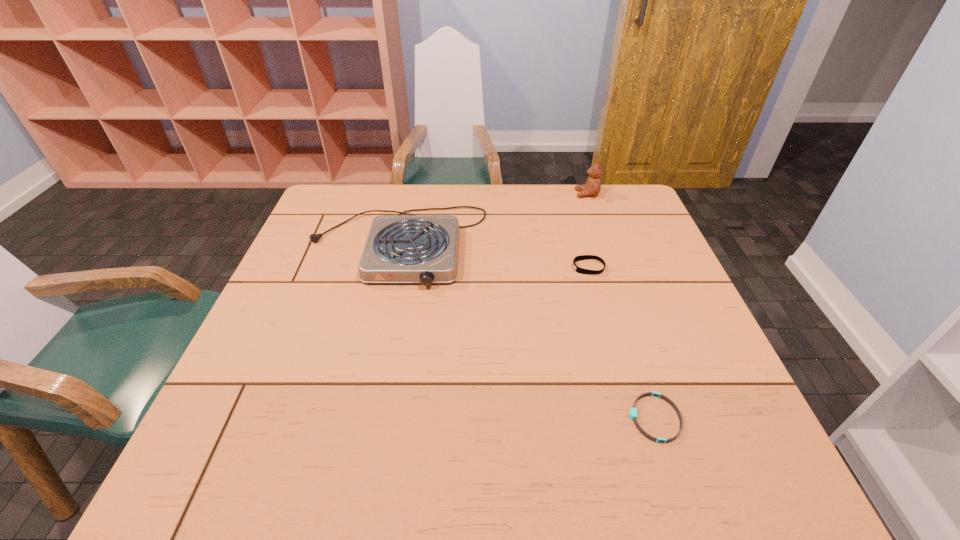
I want to click on free space between the third tallest object and the hotplate, so click(x=492, y=256).

You are a GUI agent. You are given a task and a screenshot of the screen. Output one action in this format:
    pyautogui.click(x=<x>, y=<y>)
    Task: Click on the vacant area between the hotplate and the tallest object
    The height and width of the screenshot is (540, 960).
    Given the screenshot: What is the action you would take?
    pyautogui.click(x=492, y=220)

Locate an element on the screen. The height and width of the screenshot is (540, 960). free space between the teddy bear and the second shortest object is located at coordinates (588, 231).

Identify which object is the nearest to the third shortest object. Please provide its 2D coordinates. Your answer should be formatted as a tuple, i.e. [(x, y)], where the tuple contains the x and y coordinates of a point satisfying the conditions above.

[(582, 257)]

Point out which object is positioned as the second nearest to the second tallest object. Please provide its 2D coordinates. Your answer should be formatted as a tuple, i.e. [(x, y)], where the tuple contains the x and y coordinates of a point satisfying the conditions above.

[(592, 187)]

At what (x,y) coordinates should I click in order to perform the action: click on free location that satisfies the following two spatial constraints: 1. on the face of the farthest object; 2. with a retractable cable on the side of the leftmost object. Please return your answer as a coordinate pair (x, y). This screenshot has height=540, width=960. Looking at the image, I should click on (604, 245).

You are a GUI agent. You are given a task and a screenshot of the screen. Output one action in this format:
    pyautogui.click(x=<x>, y=<y>)
    Task: Click on the vacant point that satisfies the following two spatial constraints: 1. on the face of the farthest object; 2. with a retractable cable on the side of the hotplate
    The image size is (960, 540).
    Given the screenshot: What is the action you would take?
    pyautogui.click(x=604, y=245)

At what (x,y) coordinates should I click in order to perform the action: click on free space that satisfies the following two spatial constraints: 1. on the face of the teddy bear; 2. with a retractable cable on the side of the third shortest object. Please return your answer as a coordinate pair (x, y). This screenshot has height=540, width=960. Looking at the image, I should click on (604, 245).